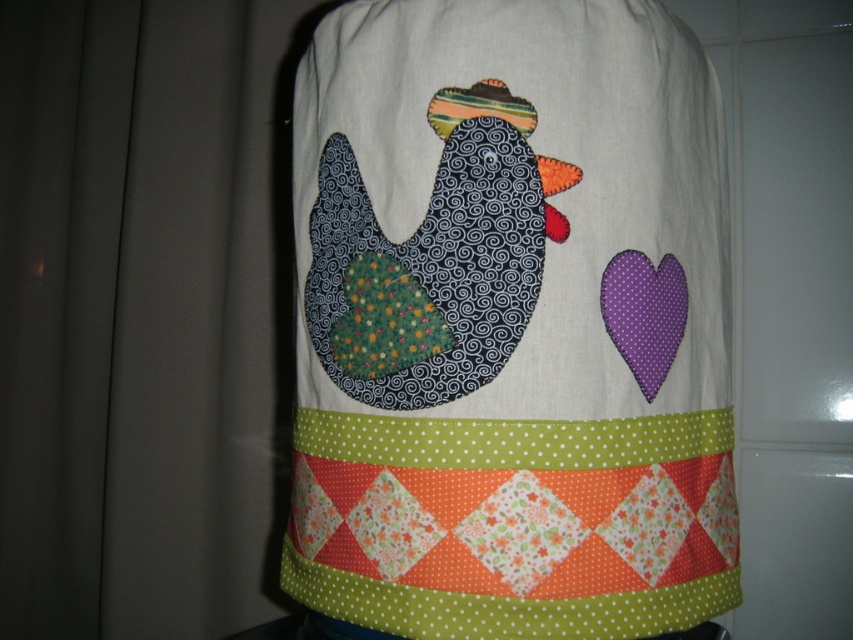
Question: Can you confirm if quilted fabric chicken at center is positioned to the left of textured dark blue chicken at center?

Choices:
 (A) yes
 (B) no

Answer: (B)

Question: Does quilted fabric chicken at center have a lesser width compared to textured dark blue chicken at center?

Choices:
 (A) no
 (B) yes

Answer: (A)

Question: Which point is farther from the camera taking this photo?

Choices:
 (A) (540, 604)
 (B) (496, 349)

Answer: (B)

Question: Is the position of quilted fabric chicken at center more distant than that of textured dark blue chicken at center?

Choices:
 (A) yes
 (B) no

Answer: (B)

Question: Which point is farther from the camera taking this photo?

Choices:
 (A) (724, 512)
 (B) (457, 324)

Answer: (A)